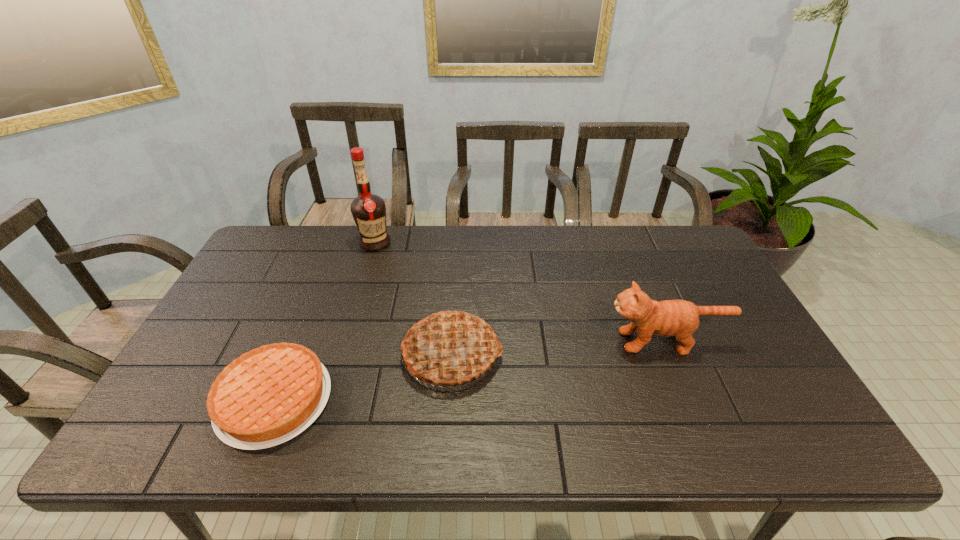
This screenshot has height=540, width=960. I want to click on free space that satisfies the following two spatial constraints: 1. on the face of the rightmost object; 2. on the front side of the shorter pie, so click(689, 400).